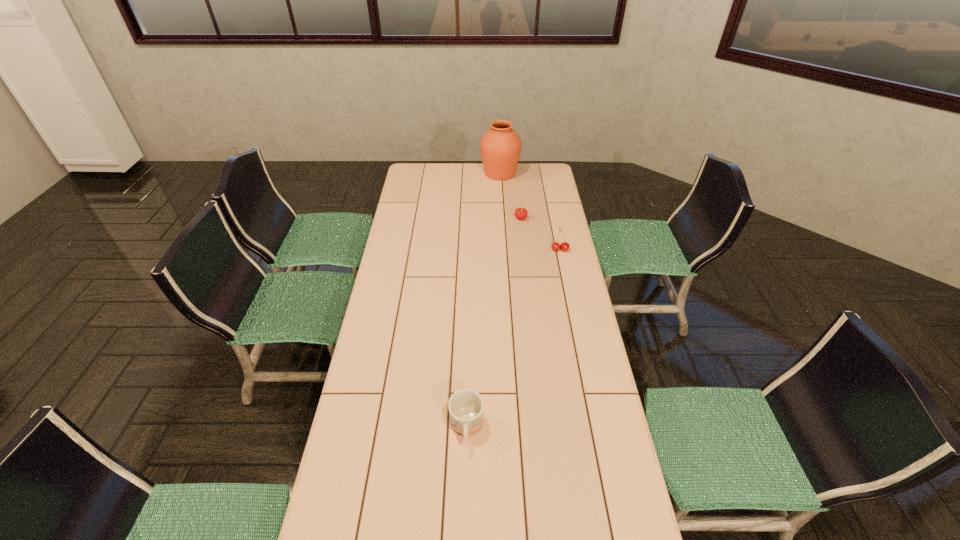
Where is `vacant space that is in between the right cherry and the farthest object`? vacant space that is in between the right cherry and the farthest object is located at coordinates (530, 212).

Image resolution: width=960 pixels, height=540 pixels. Identify the location of vacant region between the farther cherry and the farthest object. (511, 195).

This screenshot has width=960, height=540. What are the coordinates of `free space between the rightmost object and the farther cherry` in the screenshot? It's located at (540, 234).

The image size is (960, 540). I want to click on the second closest object to the left cherry, so click(x=500, y=146).

Image resolution: width=960 pixels, height=540 pixels. What are the coordinates of `object that can be found as the closest to the farthest object` in the screenshot? It's located at (521, 213).

Identify which cherry is located as the second nearest to the nearest object. Please provide its 2D coordinates. Your answer should be formatted as a tuple, i.e. [(x, y)], where the tuple contains the x and y coordinates of a point satisfying the conditions above.

[(521, 213)]